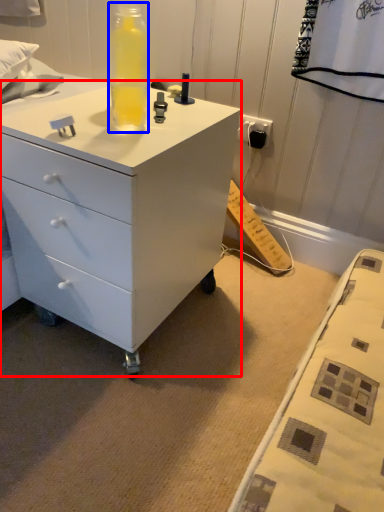
Question: Which of the following is the closest to the observer, chest of drawers (highlighted by a red box) or bottle (highlighted by a blue box)?

Choices:
 (A) chest of drawers
 (B) bottle

Answer: (A)